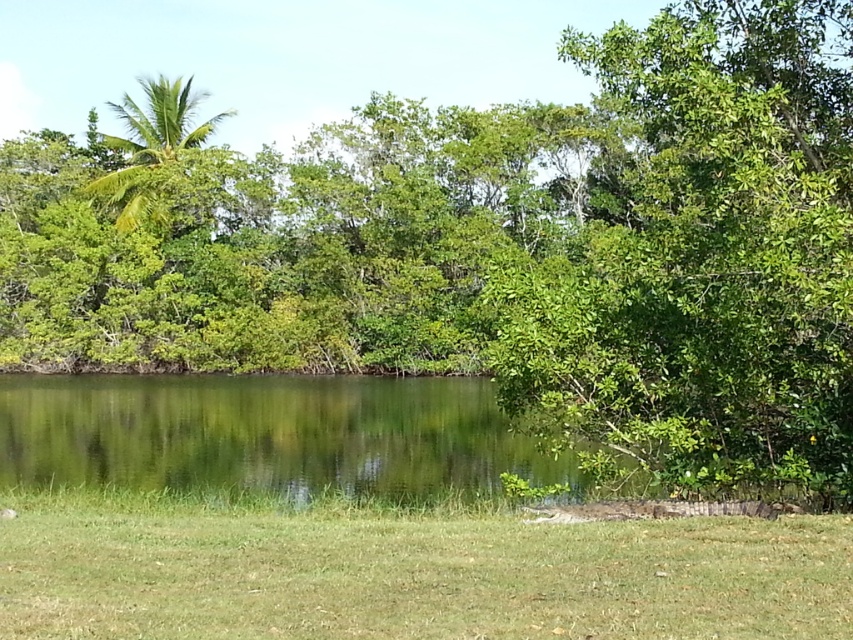
I want to click on green leafy tree at right, so click(x=704, y=260).

Between green leafy tree at right and green liquid water at center, which one appears on the left side from the viewer's perspective?

Positioned to the left is green liquid water at center.

Is point (688, 394) in front of point (642, 474)?

Yes, point (688, 394) is in front of point (642, 474).

Locate an element on the screen. Image resolution: width=853 pixels, height=640 pixels. green leafy tree at right is located at coordinates (704, 260).

Looking at this image, is green liquid water at center below green leafy palm tree at upper left?

Correct, green liquid water at center is located below green leafy palm tree at upper left.

Between point (200, 464) and point (202, 97), which one is positioned behind?

The point (202, 97) is behind.

Describe the element at coordinates (265, 436) in the screenshot. I see `green liquid water at center` at that location.

Locate an element on the screen. green liquid water at center is located at coordinates (265, 436).

Is green leafy tree at right taller than green leafy palm tree at upper left?

No.

Is point (762, 241) closer to camera compared to point (164, 90)?

Yes, it is in front of point (164, 90).

What do you see at coordinates (704, 260) in the screenshot? Image resolution: width=853 pixels, height=640 pixels. I see `green leafy tree at right` at bounding box center [704, 260].

Identify the location of green leafy tree at right. pos(704,260).